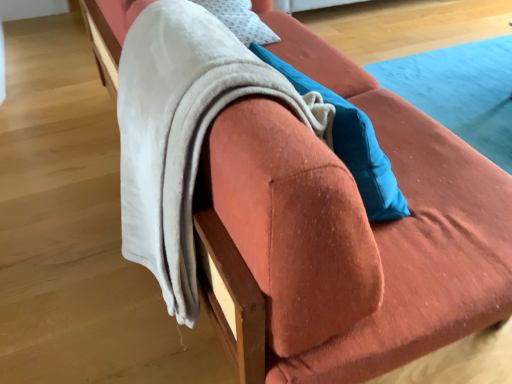
Where is `white soft pillow at upper center`? Image resolution: width=512 pixels, height=384 pixels. white soft pillow at upper center is located at coordinates (240, 20).

Describe the element at coordinates (240, 20) in the screenshot. The height and width of the screenshot is (384, 512). I see `white soft pillow at upper center` at that location.

What do you see at coordinates (182, 131) in the screenshot?
I see `soft white fleece blanket at upper left` at bounding box center [182, 131].

Where is `soft white fleece blanket at upper left`? The width and height of the screenshot is (512, 384). soft white fleece blanket at upper left is located at coordinates (182, 131).

Find the location of a particular element. This screenshot has height=384, width=512. white soft pillow at upper center is located at coordinates (240, 20).

Which object is positioned more to the left, white soft pillow at upper center or soft white fleece blanket at upper left?

soft white fleece blanket at upper left.

Which object is closer to the camera, white soft pillow at upper center or soft white fleece blanket at upper left?

Positioned in front is soft white fleece blanket at upper left.

Is point (223, 17) less distant than point (127, 46)?

No, (223, 17) is further to viewer.

From the image's perspective, is white soft pillow at upper center above or below soft white fleece blanket at upper left?

white soft pillow at upper center is above soft white fleece blanket at upper left.

In the scene shown: From a real-world perspective, does white soft pillow at upper center stand above soft white fleece blanket at upper left?

No, from a real-world perspective, white soft pillow at upper center is not above soft white fleece blanket at upper left.

Is white soft pillow at upper center wider or thinner than soft white fleece blanket at upper left?

Clearly, white soft pillow at upper center has less width compared to soft white fleece blanket at upper left.

Who is shorter, white soft pillow at upper center or soft white fleece blanket at upper left?

Standing shorter between the two is white soft pillow at upper center.

From the picture: Which of these two, white soft pillow at upper center or soft white fleece blanket at upper left, is bigger?

Bigger between the two is soft white fleece blanket at upper left.

Is white soft pillow at upper center inside or outside of soft white fleece blanket at upper left?

white soft pillow at upper center is outside soft white fleece blanket at upper left.

Would you consider white soft pillow at upper center to be distant from soft white fleece blanket at upper left?

No.

Is white soft pillow at upper center looking in the opposite direction of soft white fleece blanket at upper left?

No, white soft pillow at upper center's orientation is not away from soft white fleece blanket at upper left.

Find the location of `blanket lying in front of the white soft pillow at upper center`. blanket lying in front of the white soft pillow at upper center is located at coordinates (182, 131).

Which is more to the left, soft white fleece blanket at upper left or white soft pillow at upper center?

soft white fleece blanket at upper left.

Is soft white fleece blanket at upper left in front of or behind white soft pillow at upper center in the image?

Clearly, soft white fleece blanket at upper left is in front of white soft pillow at upper center.

Is point (151, 204) farther from camera compared to point (236, 22)?

No, (151, 204) is closer to viewer.

From the image's perspective, between soft white fleece blanket at upper left and white soft pillow at upper center, who is located below?

soft white fleece blanket at upper left appears lower in the image.

From a real-world perspective, which object rests below the other?

In real-world perspective, white soft pillow at upper center is lower.

In terms of width, does soft white fleece blanket at upper left look wider or thinner when compared to white soft pillow at upper center?

Clearly, soft white fleece blanket at upper left has more width compared to white soft pillow at upper center.

Consider the image. Who is shorter, soft white fleece blanket at upper left or white soft pillow at upper center?

Standing shorter between the two is white soft pillow at upper center.

Based on the photo, considering the relative sizes of soft white fleece blanket at upper left and white soft pillow at upper center in the image provided, is soft white fleece blanket at upper left smaller than white soft pillow at upper center?

Actually, soft white fleece blanket at upper left might be larger than white soft pillow at upper center.

Is white soft pillow at upper center located within soft white fleece blanket at upper left?

No.

Would you consider soft white fleece blanket at upper left to be distant from white soft pillow at upper center?

No, soft white fleece blanket at upper left is not far from white soft pillow at upper center.

Is soft white fleece blanket at upper left oriented away from white soft pillow at upper center?

That's not correct — soft white fleece blanket at upper left is not looking away from white soft pillow at upper center.

What's the angular difference between soft white fleece blanket at upper left and white soft pillow at upper center's facing directions?

The facing directions of soft white fleece blanket at upper left and white soft pillow at upper center are 88.9 degrees apart.

The image size is (512, 384). Find the location of `blanket below the white soft pillow at upper center (from the image's perspective)`. blanket below the white soft pillow at upper center (from the image's perspective) is located at coordinates (182, 131).

Locate an element on the screen. The image size is (512, 384). pillow behind the soft white fleece blanket at upper left is located at coordinates (240, 20).

You are a GUI agent. You are given a task and a screenshot of the screen. Output one action in this format:
    pyautogui.click(x=<x>, y=<y>)
    Task: Click on the pillow that appears on the right of soft white fleece blanket at upper left
    Image resolution: width=512 pixels, height=384 pixels.
    Given the screenshot: What is the action you would take?
    coord(240,20)